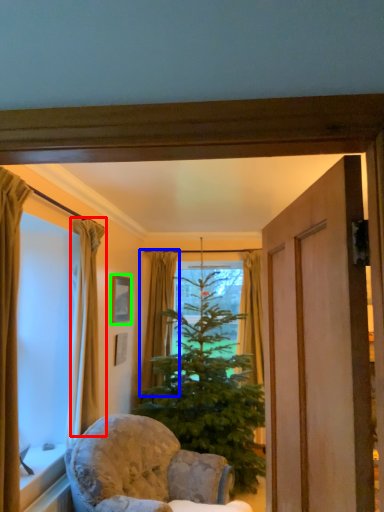
Question: Which object is positioned closest to curtain (highlighted by a red box)? Select from curtain (highlighted by a blue box) and picture frame (highlighted by a green box).

Choices:
 (A) curtain
 (B) picture frame

Answer: (B)